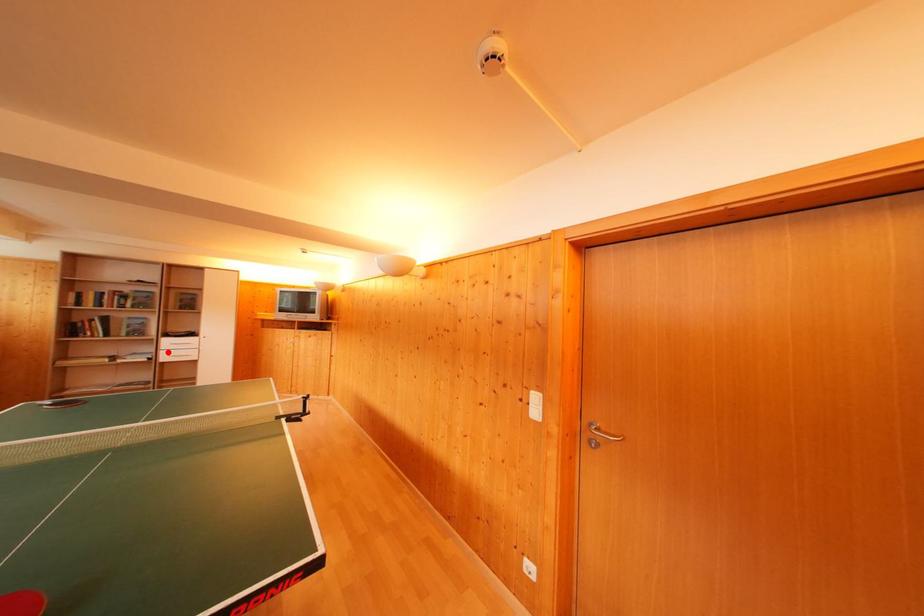
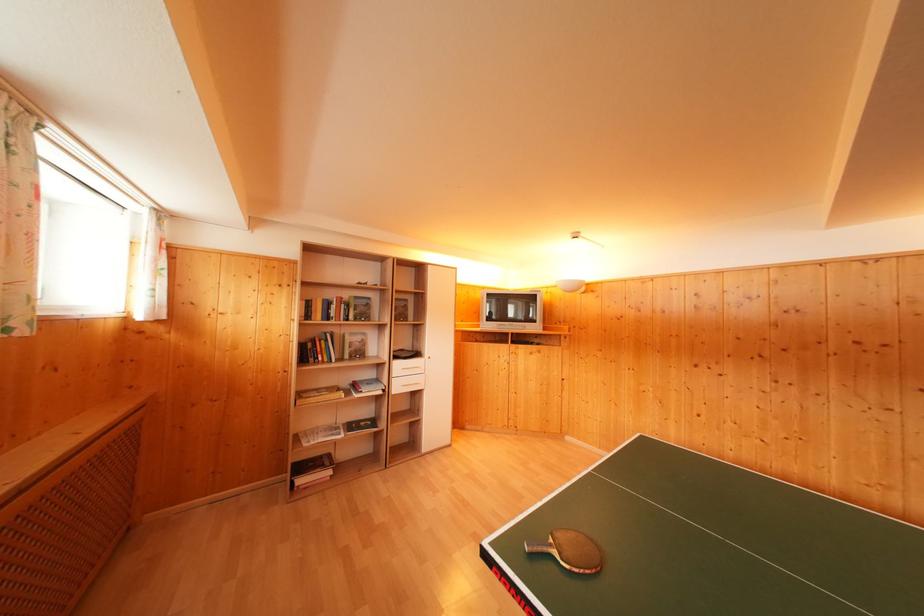
Question: I am providing you with two images of the same scene from different viewpoints. Given a red point in image1, look at the same physical point in image2. Is it:

Choices:
 (A) Closer to the viewpoint
 (B) Farther from the viewpoint

Answer: (B)